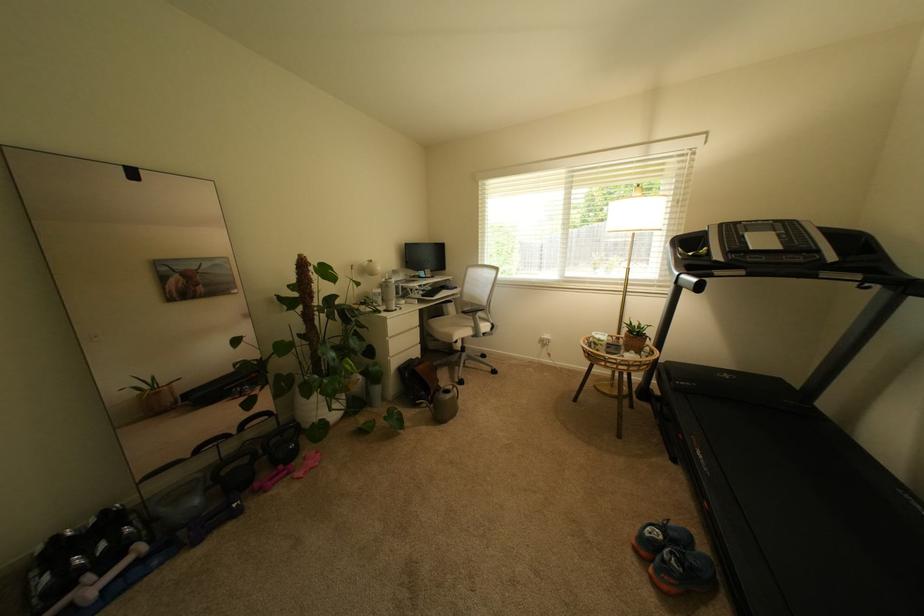
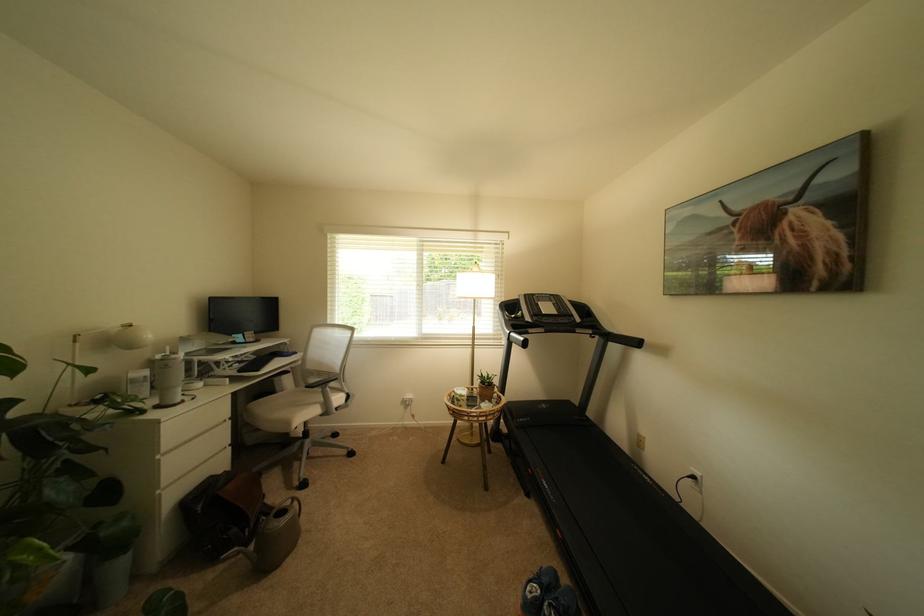
Question: The camera is either moving clockwise (left) or counter-clockwise (right) around the object. The first image is from the beginning of the video and the second image is from the end. Is the camera moving left or right when shooting the video?

Choices:
 (A) Left
 (B) Right

Answer: (A)